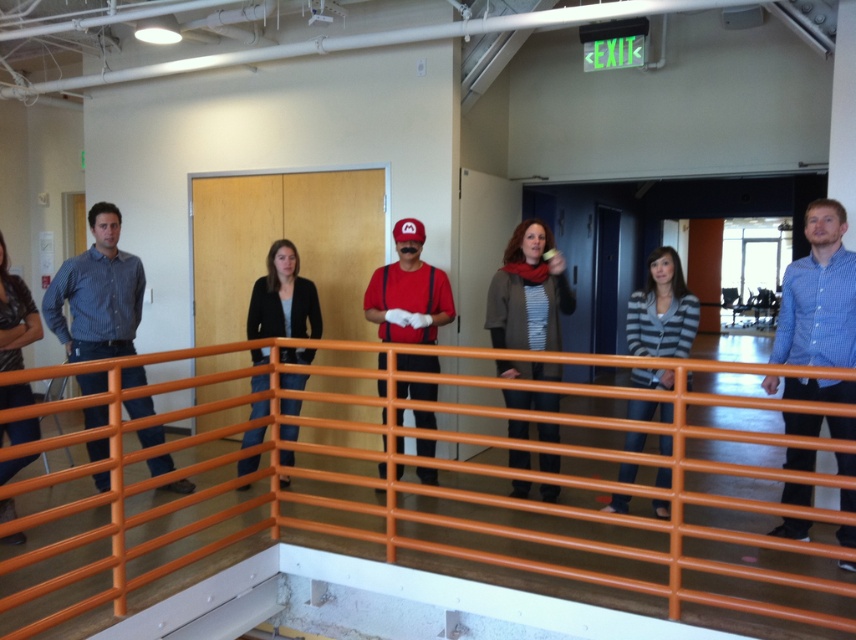
Where is the orange plastic rail at center located in the image?

The orange plastic rail at center is located at point (428, 531) in the image.

Based on the scene description, where is the orange plastic rail at center located in terms of coordinates?

The orange plastic rail at center is located at coordinates point (428, 531).

You are standing in the office space and need to reach the wooden door in the background. There is an orange plastic rail at center in your way. Can you walk around it on either side?

The orange plastic rail at center is located at point (428, 531), so yes, you can walk around it on either side since it is a horizontal rail and not blocking the entire path.